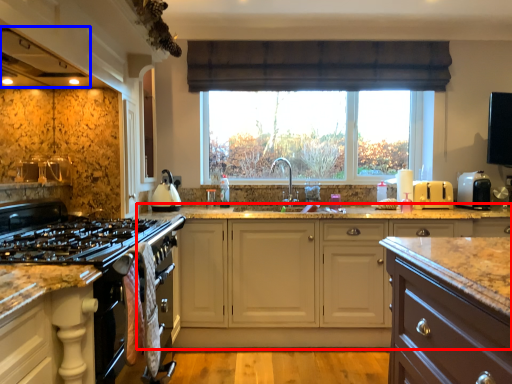
Question: Which object appears farthest to the camera in this image, cabinetry (highlighted by a red box) or exhaust hood (highlighted by a blue box)?

Choices:
 (A) cabinetry
 (B) exhaust hood

Answer: (A)